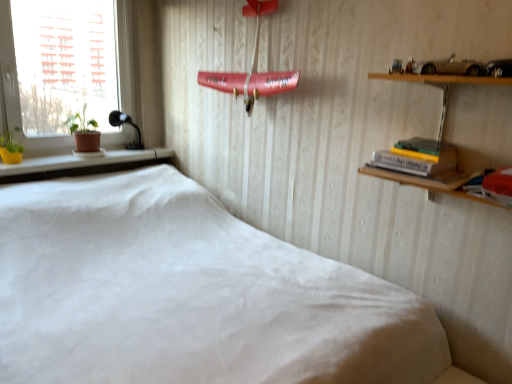
Question: From a real-world perspective, is white fabric bed at center positioned over hardcover book at upper right, which is the second book in right-to-left order, based on gravity?

Choices:
 (A) no
 (B) yes

Answer: (A)

Question: Is white fabric bed at center facing towards hardcover book at upper right, which is the second book in right-to-left order?

Choices:
 (A) yes
 (B) no

Answer: (B)

Question: Considering the relative sizes of white fabric bed at center and hardcover book at upper right, which is counted as the 1th book, starting from the left, in the image provided, is white fabric bed at center wider than hardcover book at upper right, which is counted as the 1th book, starting from the left,?

Choices:
 (A) no
 (B) yes

Answer: (B)

Question: Are white fabric bed at center and hardcover book at upper right, the second book viewed from the front, beside each other?

Choices:
 (A) yes
 (B) no

Answer: (B)

Question: Considering the relative positions of white fabric bed at center and hardcover book at upper right, which is the second book in right-to-left order, in the image provided, is white fabric bed at center to the left of hardcover book at upper right, which is the second book in right-to-left order, from the viewer's perspective?

Choices:
 (A) no
 (B) yes

Answer: (B)

Question: From the image's perspective, is white plastic window at left above or below matte red book at right, acting as the 1th book starting from the right?

Choices:
 (A) above
 (B) below

Answer: (A)

Question: From a real-world perspective, is white plastic window at left positioned above or below matte red book at right, acting as the 1th book starting from the right?

Choices:
 (A) above
 (B) below

Answer: (A)

Question: Would you say white plastic window at left is inside or outside matte red book at right, acting as the 1th book starting from the right?

Choices:
 (A) inside
 (B) outside

Answer: (B)

Question: Does point (124, 33) appear closer or farther from the camera than point (488, 183)?

Choices:
 (A) farther
 (B) closer

Answer: (A)

Question: Is matte red book at right, the first book positioned from the front, bigger or smaller than white fabric bed at center?

Choices:
 (A) small
 (B) big

Answer: (A)

Question: Is point (509, 185) positioned closer to the camera than point (215, 367)?

Choices:
 (A) farther
 (B) closer

Answer: (A)

Question: Looking at their shapes, would you say matte red book at right, positioned as the second book in back-to-front order, is wider or thinner than white fabric bed at center?

Choices:
 (A) wide
 (B) thin

Answer: (B)

Question: From a real-world perspective, relative to white fabric bed at center, is matte red book at right, the second book from the left, vertically above or below?

Choices:
 (A) below
 (B) above

Answer: (B)

Question: From a real-world perspective, is white plastic window at left positioned above or below black glass lamp at left?

Choices:
 (A) above
 (B) below

Answer: (A)

Question: Considering the positions of white plastic window at left and black glass lamp at left in the image, is white plastic window at left taller or shorter than black glass lamp at left?

Choices:
 (A) tall
 (B) short

Answer: (A)